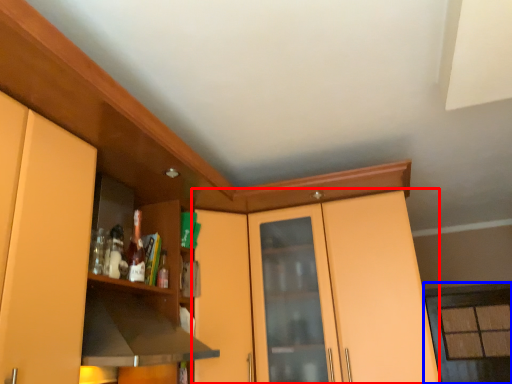
Question: Which object is closer to the camera taking this photo, dresser (highlighted by a red box) or window (highlighted by a blue box)?

Choices:
 (A) dresser
 (B) window

Answer: (A)